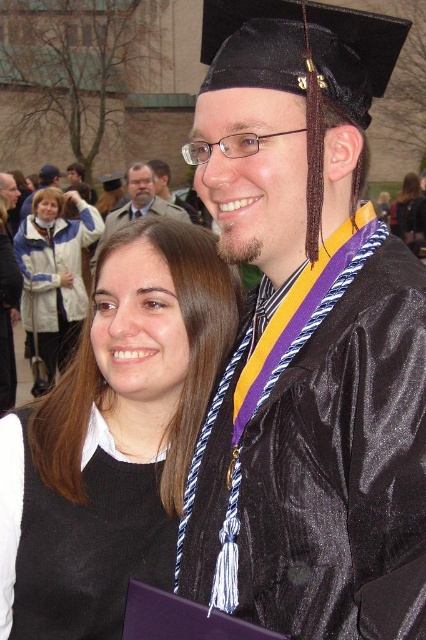
Question: Does black matte vest at lower left come behind matte black dress at center?

Choices:
 (A) yes
 (B) no

Answer: (B)

Question: Which object is the closest to the black sweater at center?

Choices:
 (A) black matte vest at lower left
 (B) white fleece jacket at upper left
 (C) matte black graduation gown at upper center

Answer: (A)

Question: From the image, what is the correct spatial relationship of white fleece jacket at upper left in relation to matte black graduation cap at upper center?

Choices:
 (A) above
 (B) below

Answer: (B)

Question: Does black matte vest at lower left appear under matte black graduation gown at upper center?

Choices:
 (A) yes
 (B) no

Answer: (A)

Question: Which object is the closest to the matte black graduation gown at center?

Choices:
 (A) matte black dress at center
 (B) matte black graduation cap at upper center
 (C) matte black graduation gown at upper center

Answer: (B)

Question: Which point appears farthest from the camera in this image?

Choices:
 (A) (77, 513)
 (B) (425, 204)
 (C) (109, 227)

Answer: (B)